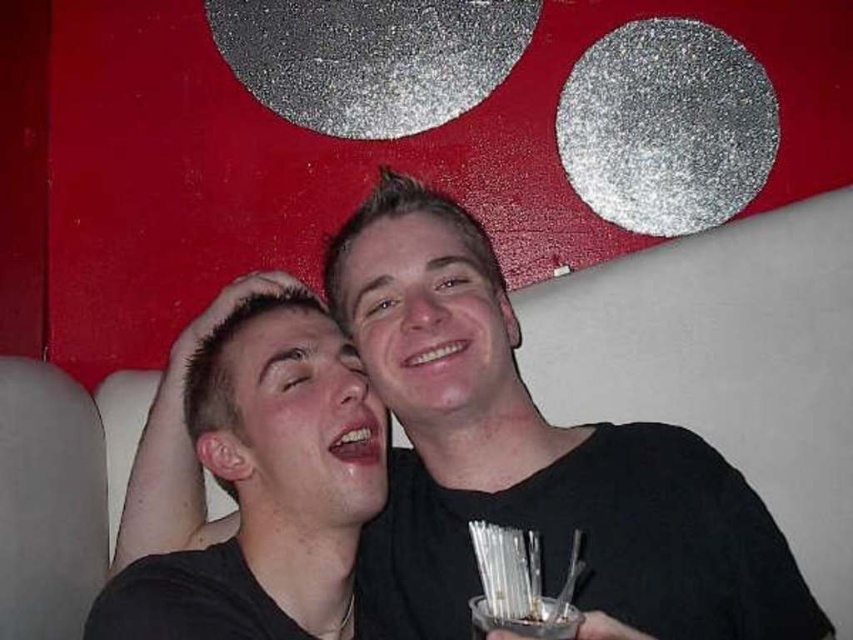
Is black matte shirt at center thinner than clear plastic cup at lower center?

In fact, black matte shirt at center might be wider than clear plastic cup at lower center.

I want to click on black matte shirt at center, so click(532, 452).

You are a GUI agent. You are given a task and a screenshot of the screen. Output one action in this format:
    pyautogui.click(x=<x>, y=<y>)
    Task: Click on the smooth skin face at center
    
    Given the screenshot: What is the action you would take?
    pyautogui.click(x=265, y=484)

From the picture: Which is more to the right, smooth skin face at center or clear plastic cup at lower center?

From the viewer's perspective, clear plastic cup at lower center appears more on the right side.

Locate an element on the screen. The height and width of the screenshot is (640, 853). smooth skin face at center is located at coordinates (265, 484).

Between black matte shirt at center and smooth skin face at center, which one has more height?

black matte shirt at center is taller.

Can you confirm if black matte shirt at center is positioned below smooth skin face at center?

No.

Image resolution: width=853 pixels, height=640 pixels. Find the location of `black matte shirt at center`. black matte shirt at center is located at coordinates (532, 452).